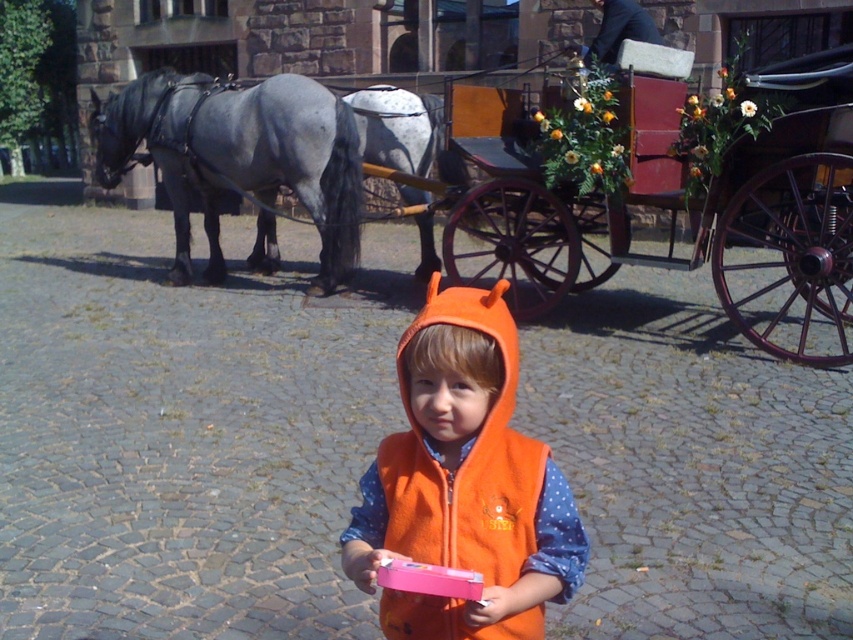
Question: Does gray glossy horse at left have a smaller size compared to wooden coach at upper center?

Choices:
 (A) no
 (B) yes

Answer: (A)

Question: Can you confirm if wooden cart at center is positioned to the left of orange fleece vest at center?

Choices:
 (A) no
 (B) yes

Answer: (A)

Question: Does orange fleece vest at center appear on the right side of wooden coach at upper center?

Choices:
 (A) no
 (B) yes

Answer: (A)

Question: Which point is farther from the camera taking this photo?

Choices:
 (A) (497, 225)
 (B) (430, 172)
 (C) (171, 172)

Answer: (A)

Question: Which of the following is the closest to the observer?

Choices:
 (A) gray glossy horse at left
 (B) gray matte horse at center
 (C) wooden cart at center

Answer: (C)

Question: Which of the following is the farthest from the observer?

Choices:
 (A) gray matte horse at center
 (B) orange fleece vest at center
 (C) gray glossy horse at left

Answer: (A)